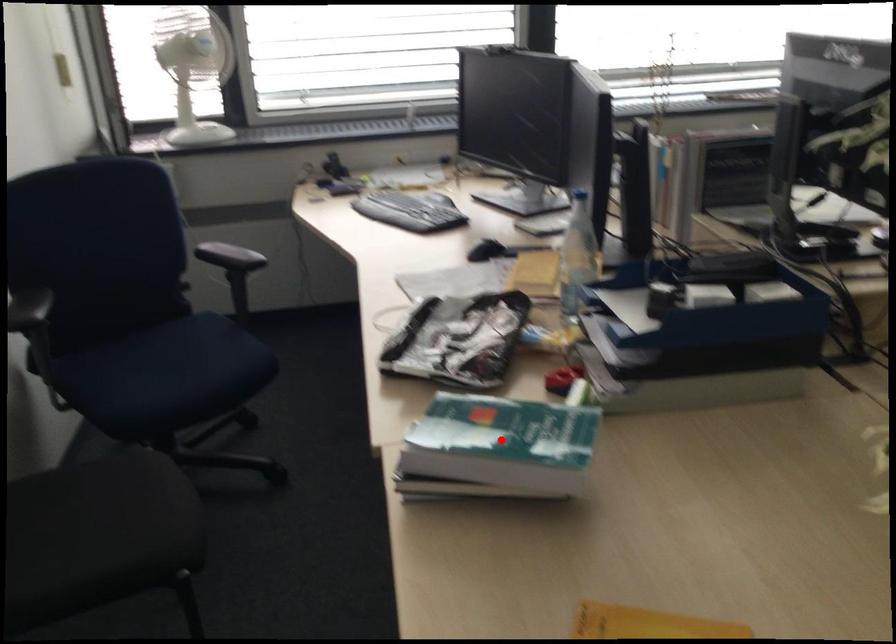
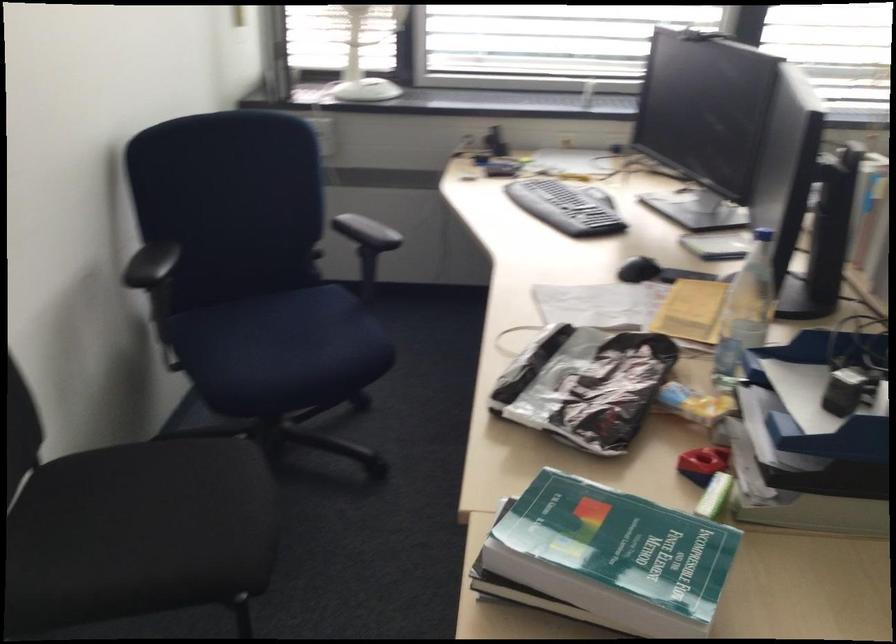
Question: I am providing you with two images of the same scene from different viewpoints. A red point is shown in image1. For the corresponding object point in image2, is it positioned nearer or farther from the camera?

Choices:
 (A) Nearer
 (B) Farther

Answer: (A)